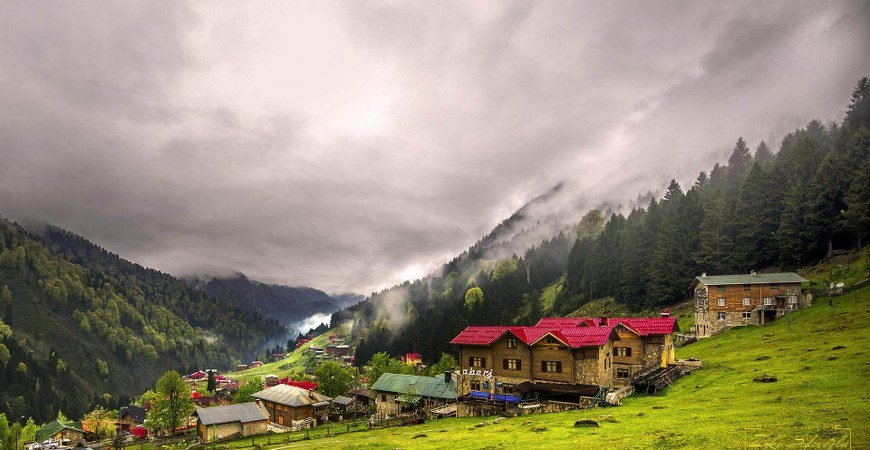
Identify the location of chimney. This screenshot has height=450, width=870. (309, 391).